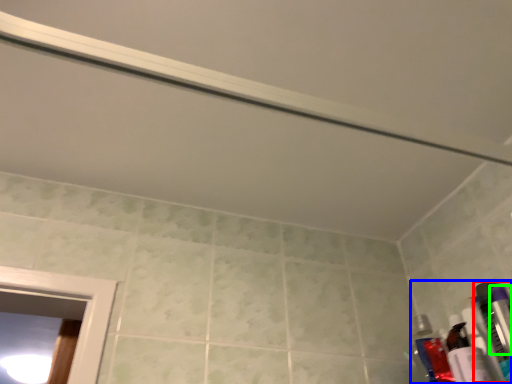
Question: Considering the real-world distances, which object is closest to toiletry (highlighted by a red box)? toiletry (highlighted by a blue box) or toiletry (highlighted by a green box).

Choices:
 (A) toiletry
 (B) toiletry

Answer: (A)